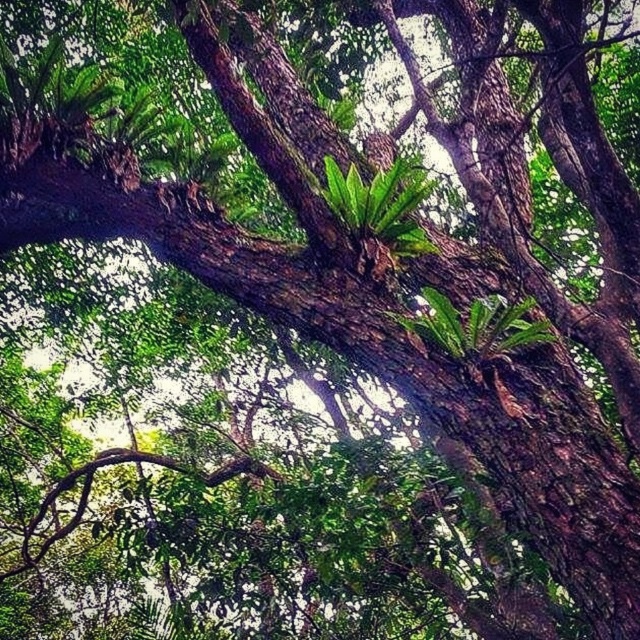
Who is more forward, (x=333, y=179) or (x=522, y=301)?

Point (x=333, y=179)

Find the location of a particular element. The height and width of the screenshot is (640, 640). green leafy fern at upper center is located at coordinates [380, 205].